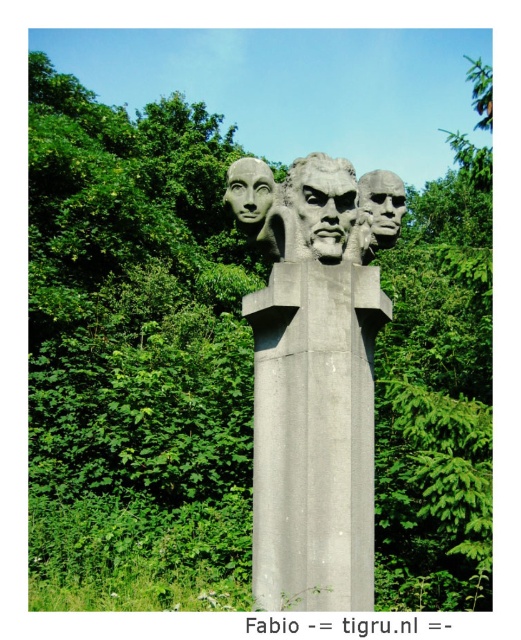
You are an art student trying to sketch the sculpture. You notice the gray concrete pillar at center and the matte gray face at center. Which object should you focus on first if you want to draw the taller one?

The gray concrete pillar at center is much taller than the matte gray face at center, so you should focus on drawing the gray concrete pillar at center first.

You are an art student analyzing the sculpture. You notice two elements, the gray concrete pillar at center and the matte gray stone face at center. Which of these two elements is bigger in size?

The gray concrete pillar at center is larger in size than the matte gray stone face at center.